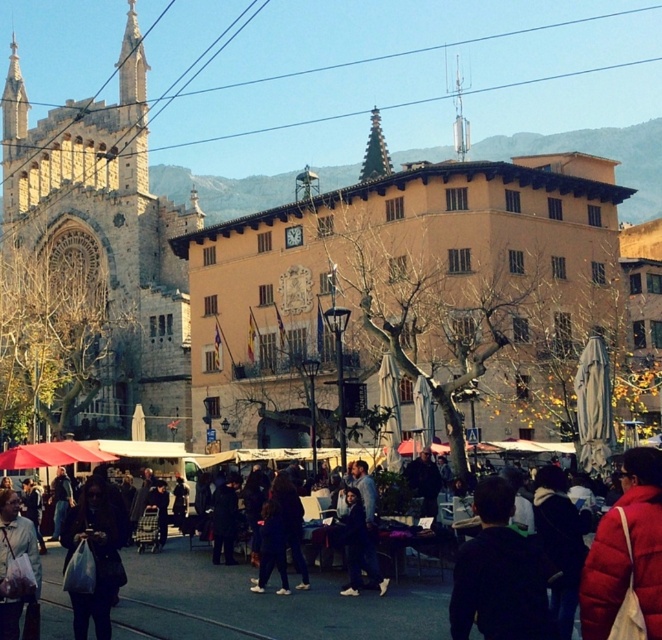
Between stone church at left and matte red jacket at center, which one is positioned higher?

stone church at left is above.

Does point (103, 227) come closer to viewer compared to point (651, 552)?

No, it is not.

This screenshot has width=662, height=640. What are the coordinates of `stone church at left` in the screenshot? It's located at (109, 232).

At what (x,y) coordinates should I click in order to perform the action: click on stone church at left. Please return your answer as a coordinate pair (x, y). Looking at the image, I should click on (109, 232).

Who is higher up, matte black jacket at lower left or white fabric bag at lower left?

white fabric bag at lower left is higher up.

What do you see at coordinates (91, 561) in the screenshot? The width and height of the screenshot is (662, 640). I see `matte black jacket at lower left` at bounding box center [91, 561].

Between point (83, 593) and point (19, 618), which one is positioned behind?

Positioned behind is point (83, 593).

The width and height of the screenshot is (662, 640). What are the coordinates of `matte black jacket at lower left` in the screenshot? It's located at (91, 561).

Does dark brown hair at center appear under white fabric bag at lower left?

Indeed, dark brown hair at center is positioned under white fabric bag at lower left.

Where is `dark brown hair at center`? The width and height of the screenshot is (662, 640). dark brown hair at center is located at coordinates point(498,573).

Which is in front, point (495, 476) or point (19, 592)?

Point (19, 592) is in front.

Identify the location of dark brown hair at center. (498, 573).